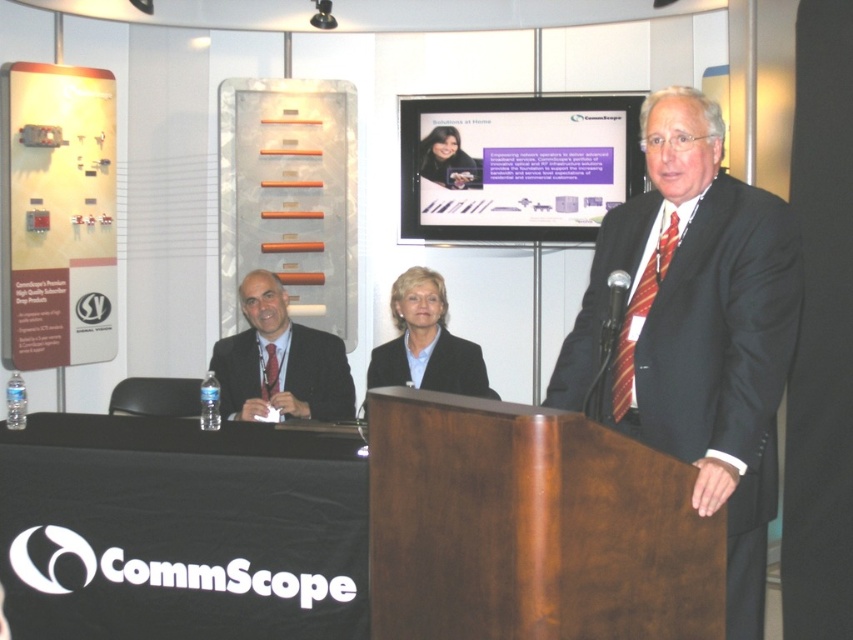
Question: Considering the real-world distances, which object is closest to the dark suit at left?

Choices:
 (A) black fabric business suit at center
 (B) smooth black jacket at upper center

Answer: (A)

Question: Which point is farther to the camera?

Choices:
 (A) dark suit at left
 (B) smooth black jacket at upper center

Answer: (B)

Question: Is dark suit at center below smooth black jacket at upper center?

Choices:
 (A) no
 (B) yes

Answer: (B)

Question: Where is dark suit at left located in relation to smooth black jacket at upper center in the image?

Choices:
 (A) left
 (B) right

Answer: (A)

Question: Which object is positioned farthest from the dark suit at left?

Choices:
 (A) smooth black jacket at upper center
 (B) black fabric business suit at center
 (C) dark suit at center

Answer: (C)

Question: Does black fabric business suit at center have a greater width compared to smooth black jacket at upper center?

Choices:
 (A) no
 (B) yes

Answer: (B)